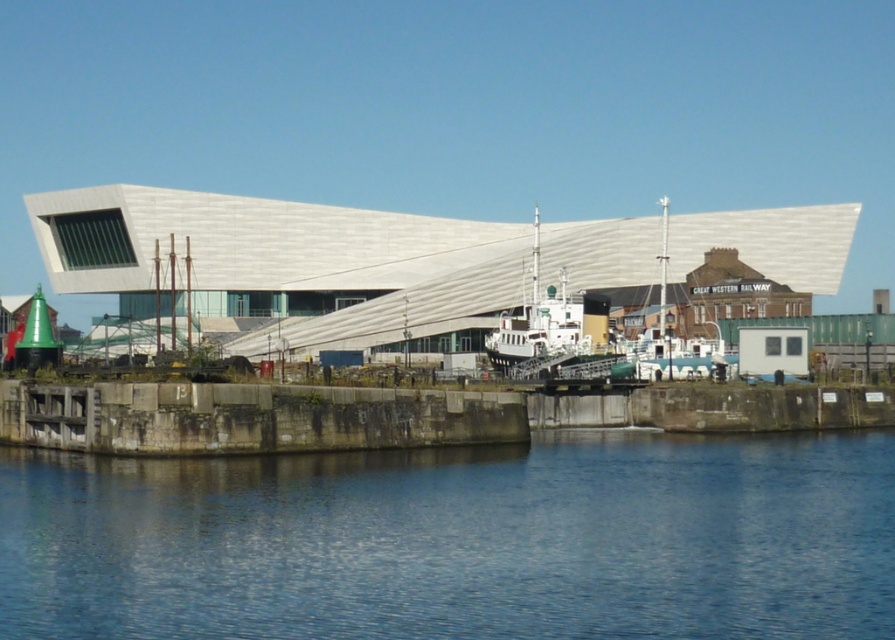
You are a photographer planning to capture the reflection of the white matte boat at center in the blue smooth water at lower center. Based on the scene, will the boat be fully reflected in the water?

The blue smooth water at lower center is positioned under the white matte boat at center, so the boat will be reflected in the water. Since the water is smooth, the reflection should be clear and the boat will be fully reflected.

You are standing at the waterfront near the modern building. You want to walk to the dock on the right side of the image. The path to the dock is 30 meters long. Is the blue smooth water at lower center within your line of sight while walking to the dock?

The blue smooth water at lower center is 25.00 meters from the viewer. Since the path to the dock is 30 meters long, the water will remain within your line of sight for the first 25 meters of the walk, but after that, you may lose sight of it as you continue toward the dock.